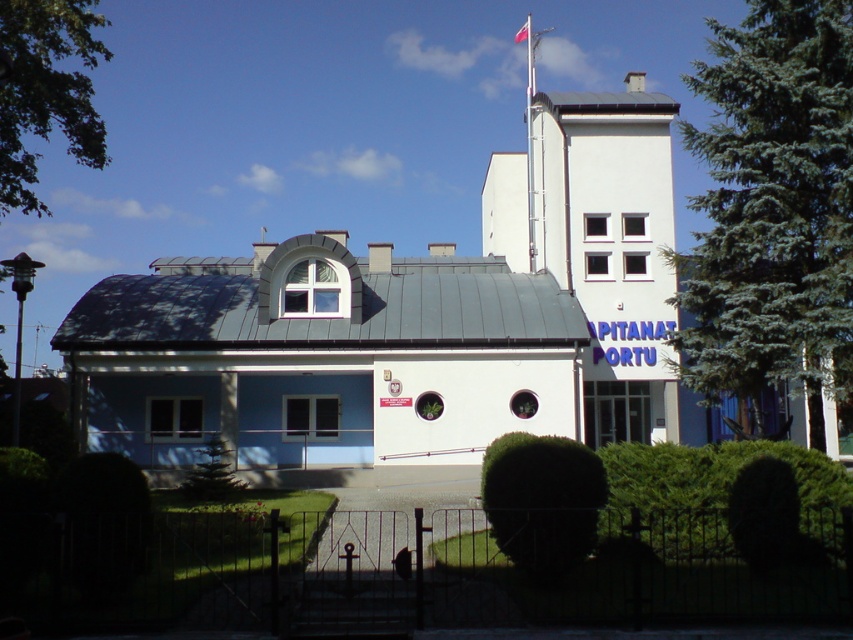
Question: Can you confirm if blue matte building at center is positioned to the right of green bushy hedge at center?

Choices:
 (A) yes
 (B) no

Answer: (B)

Question: Is green leafy tree at upper left above green leafy hedge at center?

Choices:
 (A) no
 (B) yes

Answer: (B)

Question: Which point appears farthest from the camera in this image?

Choices:
 (A) (711, 474)
 (B) (672, 259)
 (C) (24, 28)

Answer: (B)

Question: Which of the following is the closest to the observer?

Choices:
 (A) green leafy hedge at center
 (B) red fabric flag at upper center
 (C) green leafy tree at upper left
 (D) green bushy hedge at center

Answer: (D)

Question: In this image, where is green leafy tree at upper left located relative to green leafy hedge at center?

Choices:
 (A) above
 (B) below

Answer: (A)

Question: Which point is closer to the camera taking this photo?

Choices:
 (A) (747, 99)
 (B) (630, 499)
 (C) (521, 32)
 (D) (80, 58)

Answer: (B)